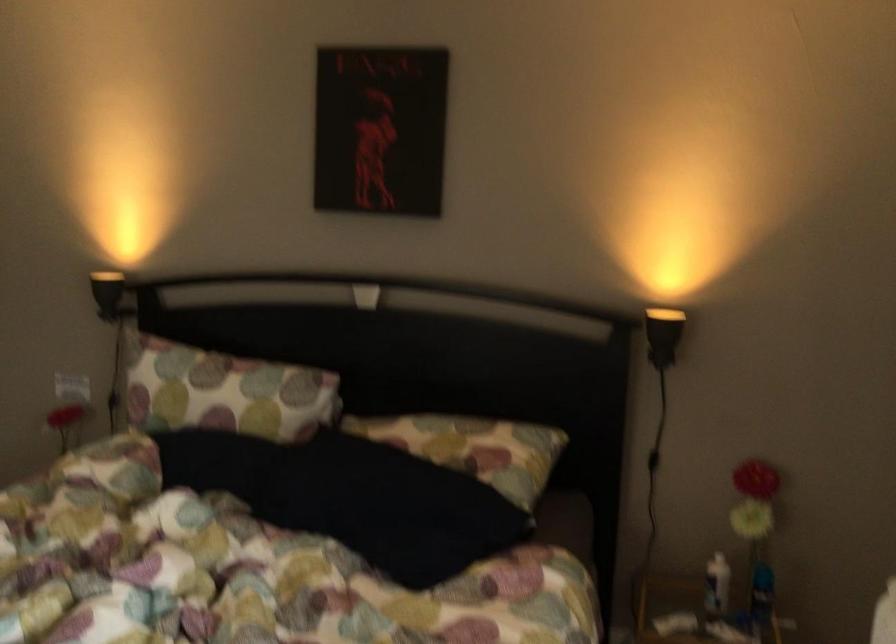
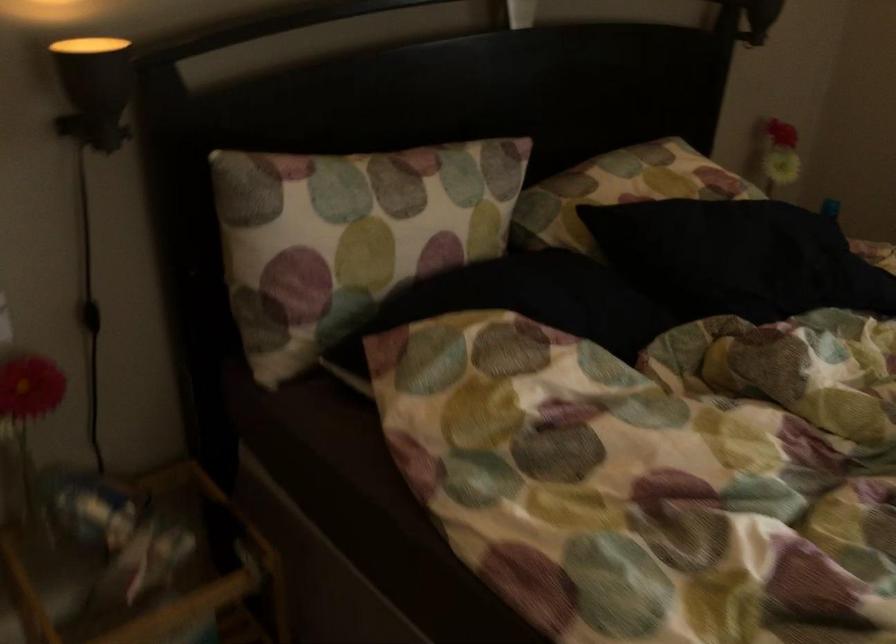
In the second image, find the point that corresponds to point 184,374 in the first image.

(367, 207)